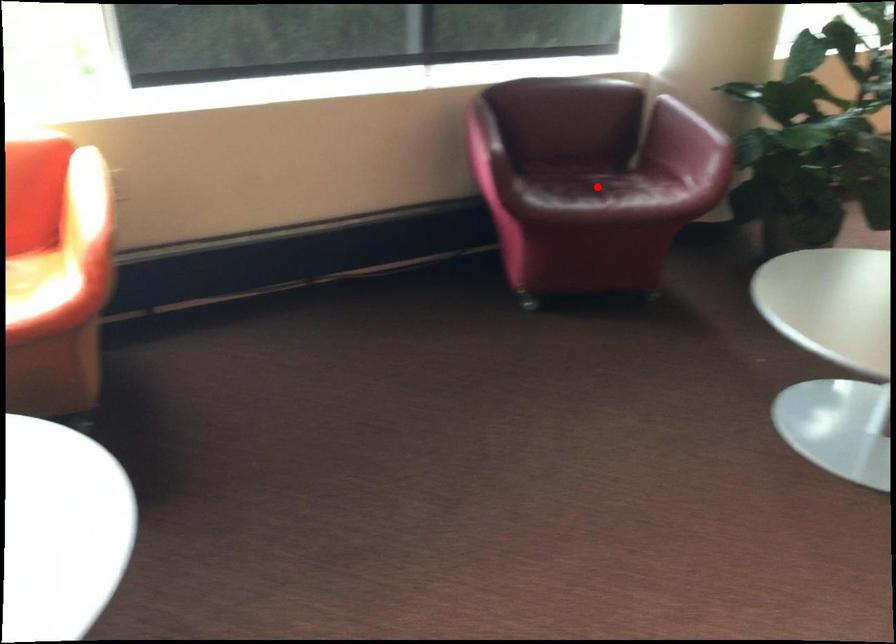
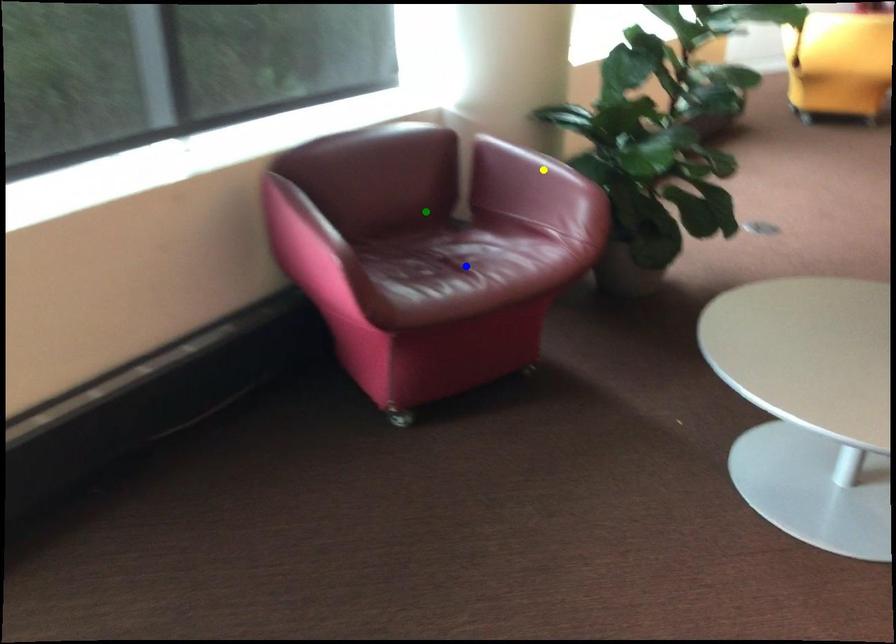
Question: I am providing you with two images of the same scene from different viewpoints. A red point is marked on the first image. You are given multiple points on the second image. Which point in image 2 represents the same 3d spot as the red point in image 1?

Choices:
 (A) yellow point
 (B) blue point
 (C) green point

Answer: (B)